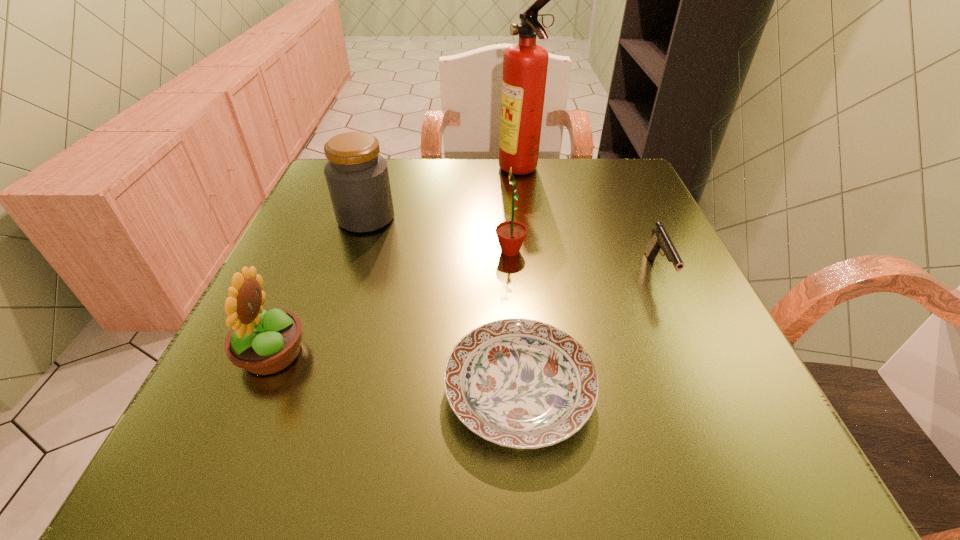
This screenshot has height=540, width=960. Find the location of `the farthest object`. the farthest object is located at coordinates (525, 64).

The width and height of the screenshot is (960, 540). What are the coordinates of `the tallest object` in the screenshot? It's located at (525, 64).

In order to click on the farther sunflower in this screenshot , I will do `click(510, 234)`.

Locate an element on the screen. Image resolution: width=960 pixels, height=540 pixels. the second farthest object is located at coordinates (357, 177).

You are a GUI agent. You are given a task and a screenshot of the screen. Output one action in this format:
    pyautogui.click(x=<x>, y=<y>)
    Task: Click on the nearer sunflower
    Image resolution: width=960 pixels, height=540 pixels.
    Given the screenshot: What is the action you would take?
    pyautogui.click(x=264, y=342)

This screenshot has width=960, height=540. What are the coordinates of `the rightmost object` in the screenshot? It's located at (660, 240).

The height and width of the screenshot is (540, 960). What are the coordinates of `pistol` in the screenshot? It's located at (660, 240).

I want to click on the shortest object, so click(520, 383).

At what (x,y) coordinates should I click in order to perform the action: click on free location located 0.220m on the front-facing side of the fire extinguisher. Please return your answer as a coordinate pair (x, y). The image size is (960, 540). Looking at the image, I should click on (410, 171).

Identify the location of vacant space located 0.300m on the front-facing side of the fire extinguisher. This screenshot has height=540, width=960. (377, 171).